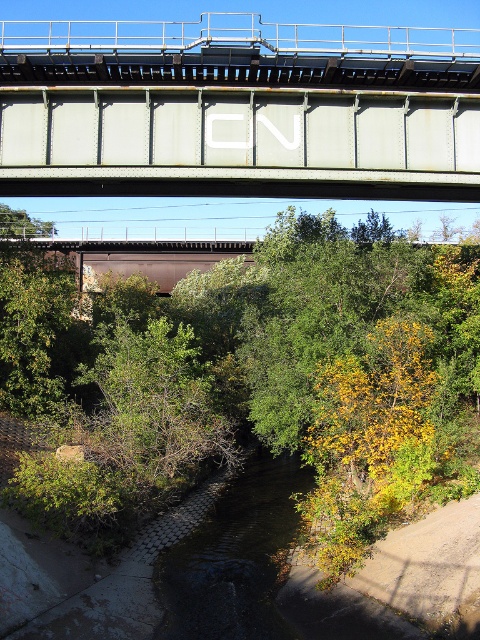
Based on the photo, you are a hiker standing on a trail near the green leafy tree at center and the rusty metal bridge at upper center. Which object is closer to you?

The green leafy tree at center is closer to you because it is positioned in front of the rusty metal bridge at upper center.

You are a hiker standing on the path near the green leafy tree at center and the rusty metal bridge at upper center. Which object is bigger in size?

The green leafy tree at center has a smaller size compared to the rusty metal bridge at upper center, so the rusty metal bridge at upper center is bigger in size.

You are a hiker standing on the path near the green leafy tree at center and the rusty metal bridge at upper center. Which object is positioned to the left when facing the scene?

The green leafy tree at center is positioned to the left of the rusty metal bridge at upper center when facing the scene.